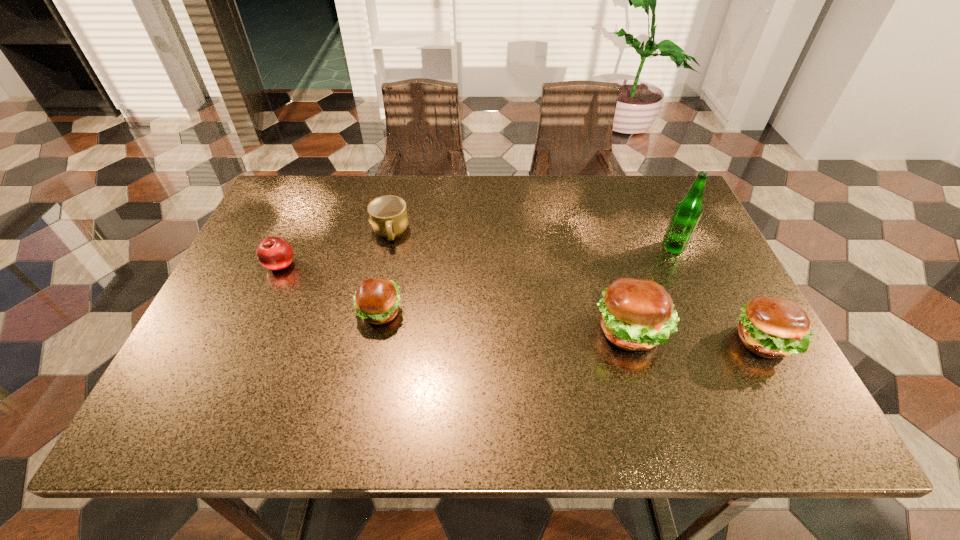
Identify the location of the closest hamburger to the leftmost object. This screenshot has width=960, height=540. (376, 301).

Identify which hamburger is the second nearest to the mug. Please provide its 2D coordinates. Your answer should be formatted as a tuple, i.e. [(x, y)], where the tuple contains the x and y coordinates of a point satisfying the conditions above.

[(637, 314)]

Where is `vacant region that satisfies the following two spatial constraints: 1. on the side with the handle of the shortest hamburger; 2. on the left side of the mug`? The height and width of the screenshot is (540, 960). vacant region that satisfies the following two spatial constraints: 1. on the side with the handle of the shortest hamburger; 2. on the left side of the mug is located at coordinates (373, 312).

The width and height of the screenshot is (960, 540). I want to click on vacant space that satisfies the following two spatial constraints: 1. on the side with the handle of the shortest hamburger; 2. on the left side of the mug, so 373,312.

I want to click on free region that satisfies the following two spatial constraints: 1. on the label of the rightmost object; 2. on the right side of the beer bottle, so click(x=715, y=341).

Locate an element on the screen. The image size is (960, 540). vacant region that satisfies the following two spatial constraints: 1. on the side with the handle of the rightmost hamburger; 2. on the right side of the mug is located at coordinates (367, 341).